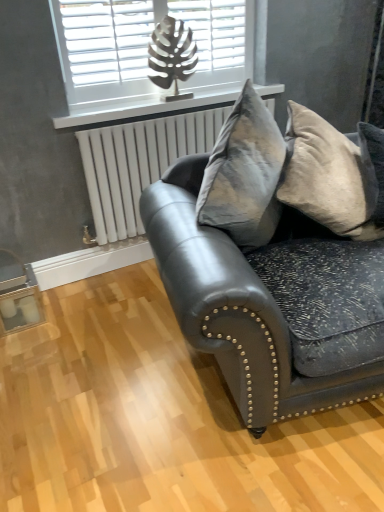
Question: From the image's perspective, relative to matte black leather couch at center, is white plastic radiator at upper center above or below?

Choices:
 (A) above
 (B) below

Answer: (A)

Question: Do you think white plastic radiator at upper center is within matte black leather couch at center, or outside of it?

Choices:
 (A) inside
 (B) outside

Answer: (B)

Question: Which is farther from the velvet gray pillow at right?

Choices:
 (A) matte black leather couch at center
 (B) white metallic radiator at upper center
 (C) white plastic radiator at upper center
 (D) white matte window at upper center

Answer: (D)

Question: Which is nearer to the white plastic radiator at upper center?

Choices:
 (A) white matte window at upper center
 (B) velvet gray pillow at right
 (C) white metallic radiator at upper center
 (D) matte black leather couch at center

Answer: (C)